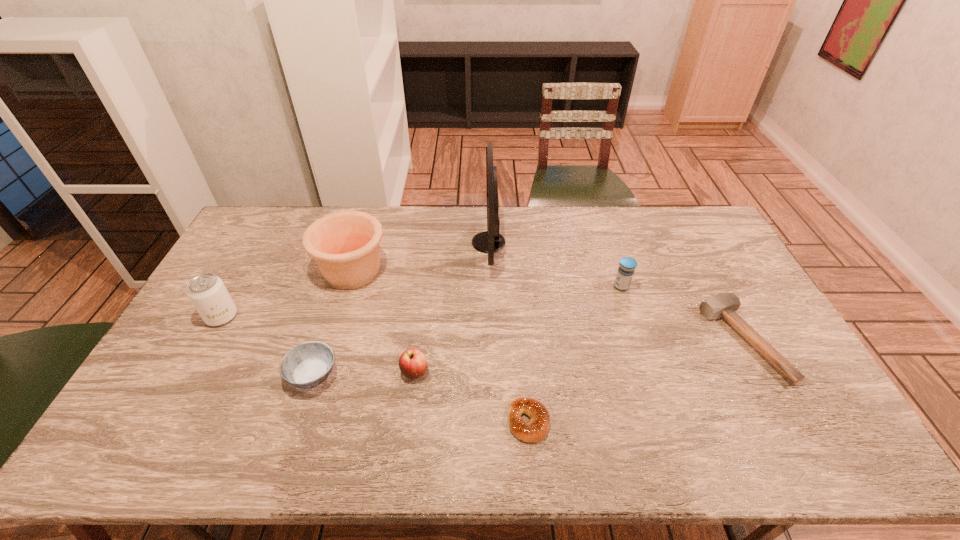
At what (x,y) coordinates should I click in order to perform the action: click on computer monitor. Please return your answer as a coordinate pair (x, y). Image resolution: width=960 pixels, height=540 pixels. Looking at the image, I should click on (490, 241).

You are a GUI agent. You are given a task and a screenshot of the screen. Output one action in this format:
    pyautogui.click(x=<x>, y=<y>)
    Task: Click on the pottery
    The image size is (960, 540).
    Given the screenshot: What is the action you would take?
    pyautogui.click(x=345, y=245)

What are the coordinates of `the leftmost object` in the screenshot? It's located at (207, 292).

I want to click on medicine, so click(627, 265).

This screenshot has height=540, width=960. In order to click on the second object from right to left in this screenshot , I will do `click(627, 265)`.

This screenshot has height=540, width=960. I want to click on the fifth object from right to left, so click(412, 363).

Locate an element on the screen. The width and height of the screenshot is (960, 540). apple is located at coordinates click(412, 363).

Locate an element on the screen. This screenshot has height=540, width=960. ashtray is located at coordinates (307, 365).

Locate an element on the screen. Image resolution: width=960 pixels, height=540 pixels. the rightmost object is located at coordinates (723, 305).

Where is `mallet`? mallet is located at coordinates (723, 305).